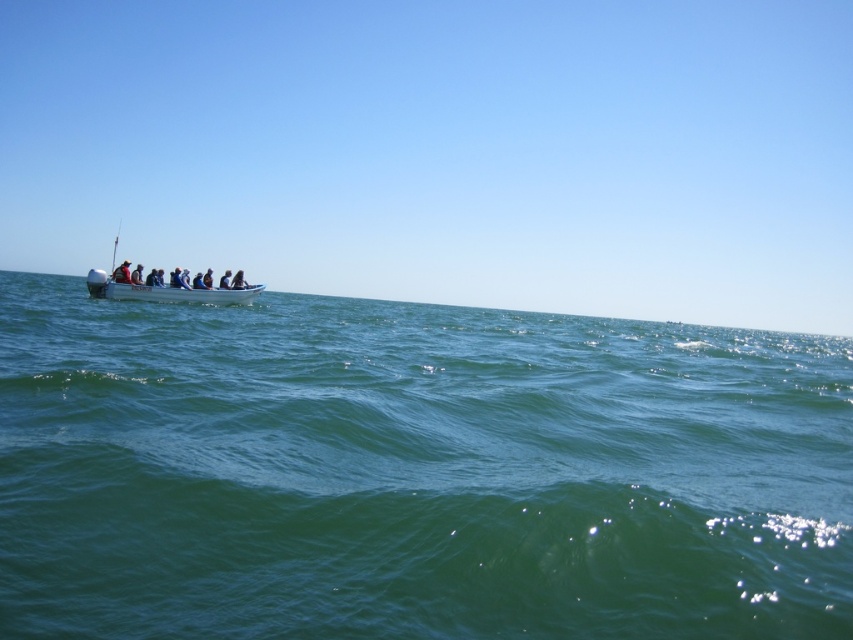
Based on the photo, between green water at left and dark blue fabric boat at center, which one has more height?

With more height is green water at left.

Which is more to the right, green water at left or dark blue fabric boat at center?

green water at left

Locate an element on the screen. The height and width of the screenshot is (640, 853). green water at left is located at coordinates (415, 472).

Is white plastic boat at left to the right of dark blue fabric boat at center from the viewer's perspective?

Yes, white plastic boat at left is to the right of dark blue fabric boat at center.

Which of these two, white plastic boat at left or dark blue fabric boat at center, stands shorter?

dark blue fabric boat at center

Is point (148, 296) behind point (181, 285)?

No.

Identify the location of white plastic boat at left. (166, 288).

Is green water at left to the right of white plastic boat at left from the viewer's perspective?

Correct, you'll find green water at left to the right of white plastic boat at left.

Is the position of green water at left more distant than that of white plastic boat at left?

No, green water at left is in front of white plastic boat at left.

At what (x,y) coordinates should I click in order to perform the action: click on green water at left. Please return your answer as a coordinate pair (x, y). The image size is (853, 640). Looking at the image, I should click on (415, 472).